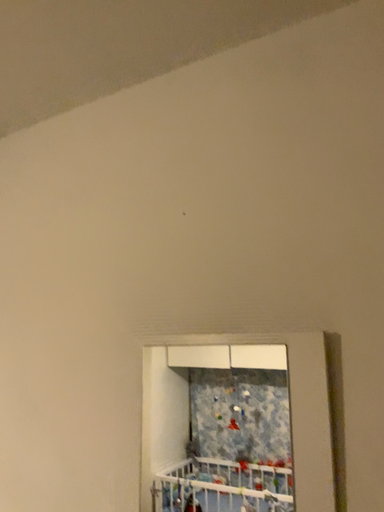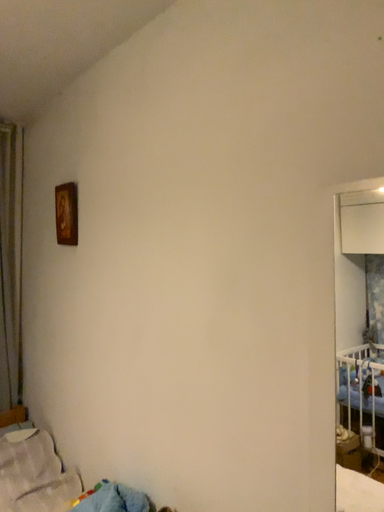
Question: Which way did the camera rotate in the video?

Choices:
 (A) rotated upward
 (B) rotated downward

Answer: (B)